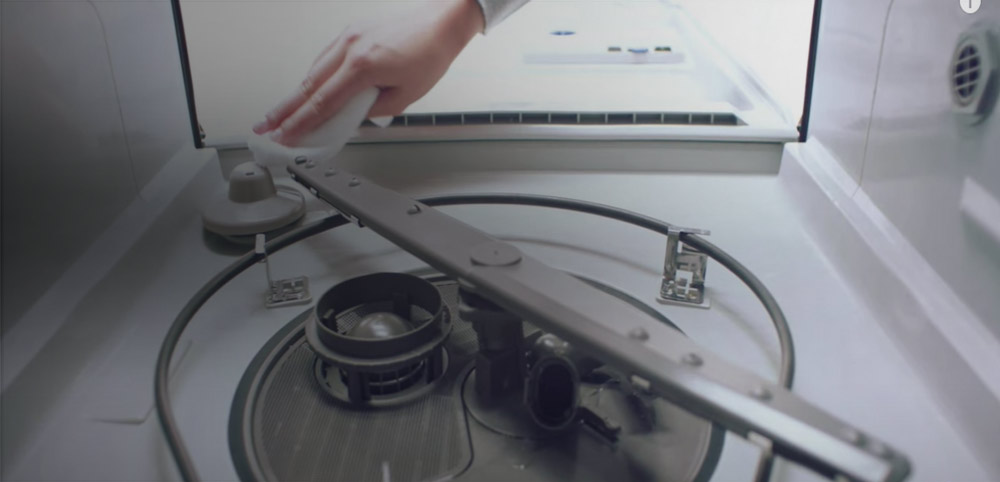
This screenshot has width=1000, height=482. I want to click on interior bottom of dishwasher, so click(x=600, y=248).